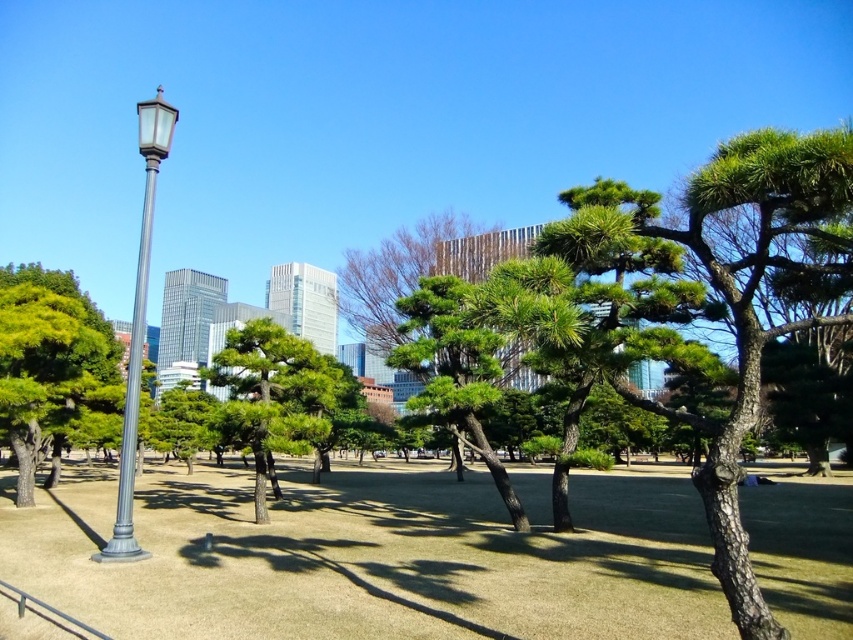
Who is more forward, (314, 433) or (138, 250)?

Point (138, 250) is more forward.

Is green textured tree at center smaller than polished metal street light at left?

Indeed, green textured tree at center has a smaller size compared to polished metal street light at left.

What do you see at coordinates (273, 396) in the screenshot? I see `green textured tree at center` at bounding box center [273, 396].

The width and height of the screenshot is (853, 640). Find the location of `green textured tree at center`. green textured tree at center is located at coordinates (273, 396).

Can you confirm if green textured tree at left is positioned to the right of polished metal street light at left?

Yes, green textured tree at left is to the right of polished metal street light at left.

Identify the location of green textured tree at left. (51, 369).

The width and height of the screenshot is (853, 640). I want to click on green textured tree at left, so click(x=51, y=369).

Does point (49, 339) come behind point (254, 340)?

That is True.

Is green textured tree at left to the right of green textured tree at center from the viewer's perspective?

Incorrect, green textured tree at left is not on the right side of green textured tree at center.

This screenshot has height=640, width=853. Find the location of `green textured tree at left`. green textured tree at left is located at coordinates (51, 369).